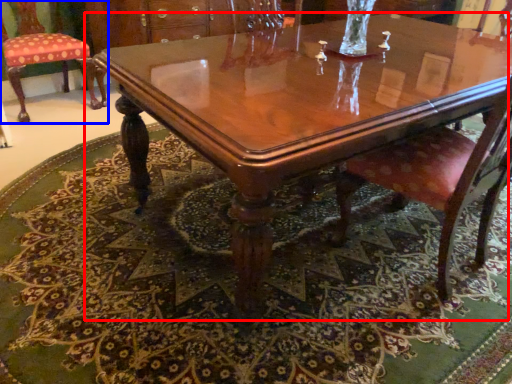
Question: Which object appears closest to the camera in this image, coffee table (highlighted by a red box) or chair (highlighted by a blue box)?

Choices:
 (A) coffee table
 (B) chair

Answer: (A)